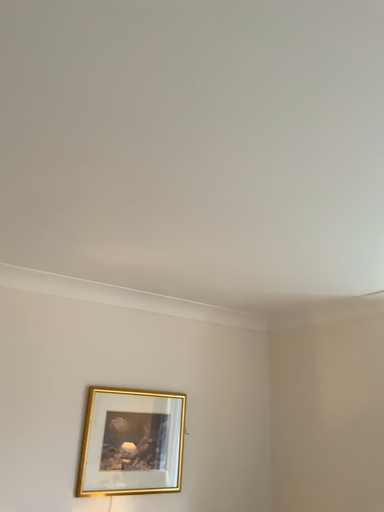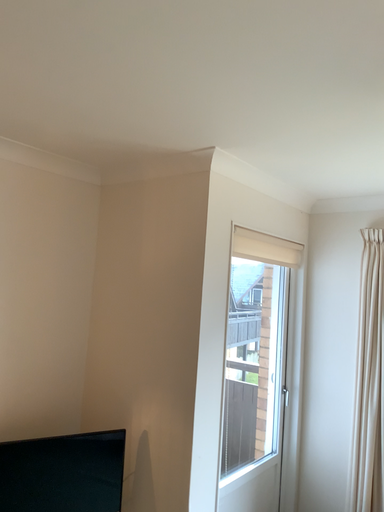
Question: Which way did the camera rotate in the video?

Choices:
 (A) rotated upward
 (B) rotated downward

Answer: (B)